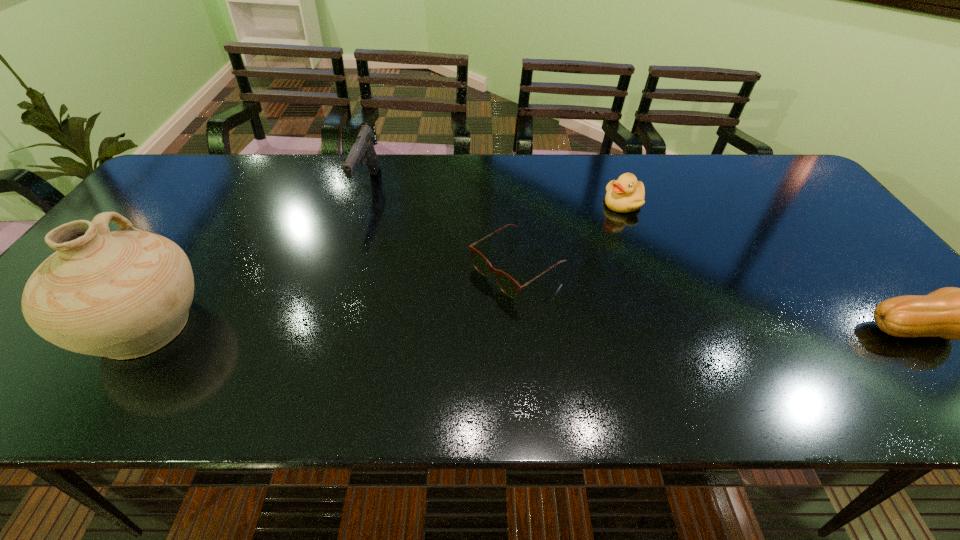
In order to click on object that is at the left edge in this screenshot , I will do `click(124, 294)`.

The image size is (960, 540). Identify the location of object that is positioned at the near left corner. (124, 294).

Locate an element on the screen. Image resolution: width=960 pixels, height=540 pixels. vacant space at the far edge is located at coordinates (556, 191).

I want to click on vacant space at the near edge, so click(x=651, y=355).

Find the location of `vacant area at the left edge`. vacant area at the left edge is located at coordinates (152, 202).

At what (x,y) coordinates should I click in order to perform the action: click on free space at the right edge of the desktop. Please return your answer as a coordinate pair (x, y). Looking at the image, I should click on (790, 204).

At what (x,y) coordinates should I click in order to perform the action: click on vacant position at the far left corner of the desktop. Please return your answer as a coordinate pair (x, y). The height and width of the screenshot is (540, 960). Looking at the image, I should click on (168, 178).

This screenshot has height=540, width=960. Identify the location of free space between the duckling and the shortest object. (570, 236).

I want to click on blank region between the fourth shortest object and the third object from left to right, so coord(443,228).

In order to click on unoccupied area between the fourth object from right to left and the pottery in this screenshot , I will do `click(257, 256)`.